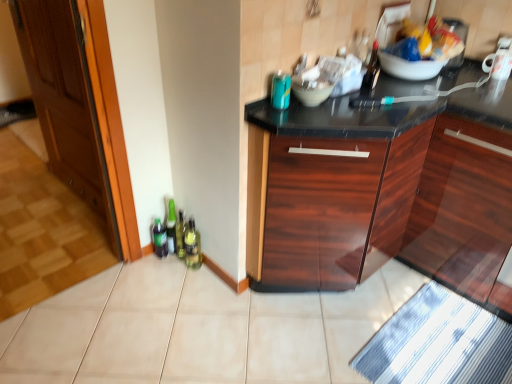
Question: Does glossy wood cabinet at center have a lesser width compared to matte white bowl at center?

Choices:
 (A) yes
 (B) no

Answer: (B)

Question: Can you confirm if glossy wood cabinet at center is positioned to the right of matte white bowl at center?

Choices:
 (A) no
 (B) yes

Answer: (B)

Question: From the image's perspective, is glossy wood cabinet at center located above matte white bowl at center?

Choices:
 (A) no
 (B) yes

Answer: (A)

Question: From a real-world perspective, is glossy wood cabinet at center physically below matte white bowl at center?

Choices:
 (A) no
 (B) yes

Answer: (B)

Question: Considering the relative sizes of glossy wood cabinet at center and matte white bowl at center in the image provided, is glossy wood cabinet at center smaller than matte white bowl at center?

Choices:
 (A) yes
 (B) no

Answer: (B)

Question: Is point pos(501,61) positioned closer to the camera than point pos(190,246)?

Choices:
 (A) closer
 (B) farther

Answer: (A)

Question: Considering the relative positions of white glossy mug at upper right and green glass bottle at lower left in the image provided, is white glossy mug at upper right to the left or to the right of green glass bottle at lower left?

Choices:
 (A) left
 (B) right

Answer: (B)

Question: Is white glossy mug at upper right wider or thinner than green glass bottle at lower left?

Choices:
 (A) wide
 (B) thin

Answer: (A)

Question: In terms of height, does white glossy mug at upper right look taller or shorter compared to green glass bottle at lower left?

Choices:
 (A) tall
 (B) short

Answer: (B)

Question: From the image's perspective, relative to matte white bowl at center, is plastic bag of chips at upper center above or below?

Choices:
 (A) above
 (B) below

Answer: (A)

Question: From a real-world perspective, is plastic bag of chips at upper center above or below matte white bowl at center?

Choices:
 (A) above
 (B) below

Answer: (A)

Question: Relative to matte white bowl at center, is plastic bag of chips at upper center in front or behind?

Choices:
 (A) behind
 (B) front

Answer: (A)

Question: Visually, is plastic bag of chips at upper center positioned to the left or to the right of matte white bowl at center?

Choices:
 (A) left
 (B) right

Answer: (B)

Question: Based on their positions, is matte white bowl at center located to the left or right of green glass bottle at lower left?

Choices:
 (A) left
 (B) right

Answer: (B)

Question: From the image's perspective, is matte white bowl at center located above or below green glass bottle at lower left?

Choices:
 (A) above
 (B) below

Answer: (A)